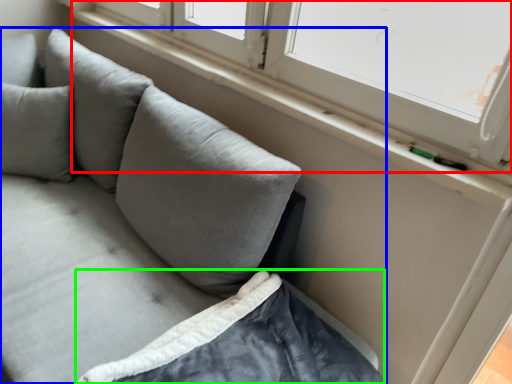
Question: Which is nearer to the window (highlighted by a red box)? studio couch (highlighted by a blue box) or sheet (highlighted by a green box).

Choices:
 (A) studio couch
 (B) sheet

Answer: (A)